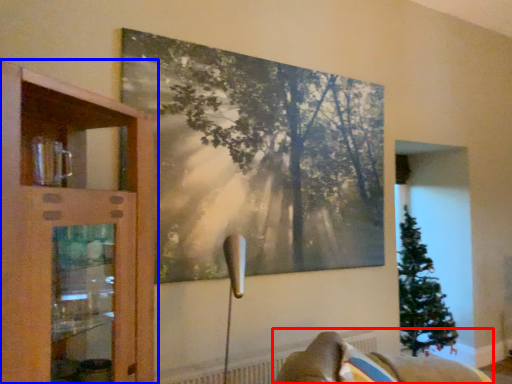
Question: Which of the following is the closest to the observer, furniture (highlighted by a red box) or cupboard (highlighted by a blue box)?

Choices:
 (A) furniture
 (B) cupboard

Answer: (B)